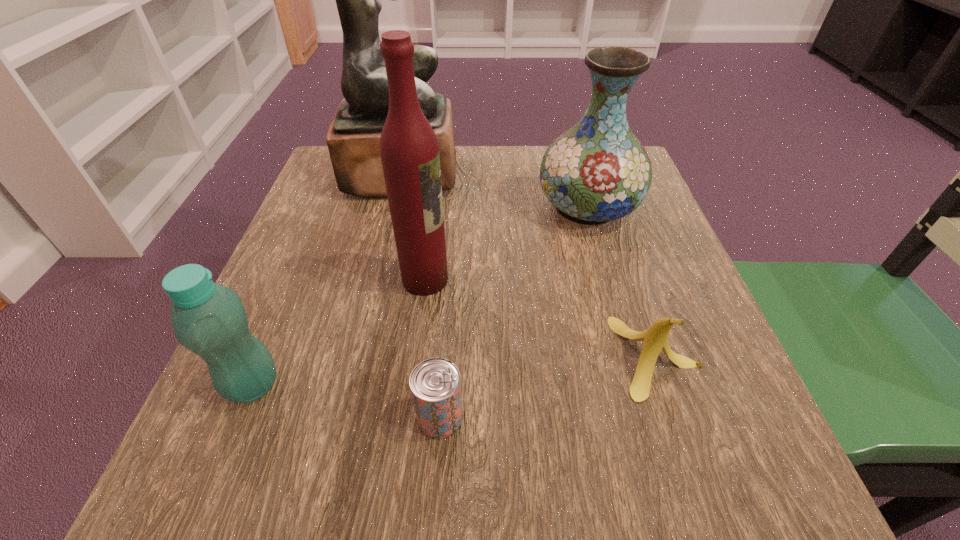
Where is `the tallest object`? the tallest object is located at coordinates (353, 139).

This screenshot has height=540, width=960. I want to click on the fifth shortest object, so click(409, 150).

At what (x,y) coordinates should I click in order to perform the action: click on the third farthest object. Please return your answer as a coordinate pair (x, y). Looking at the image, I should click on (409, 150).

Image resolution: width=960 pixels, height=540 pixels. Identify the location of vase. (597, 171).

Image resolution: width=960 pixels, height=540 pixels. I want to click on water bottle, so click(x=209, y=319).

Image resolution: width=960 pixels, height=540 pixels. Identify the location of banana. (656, 338).

Locate an element on the screen. beer can is located at coordinates (435, 383).

Image resolution: width=960 pixels, height=540 pixels. I want to click on vacant space positioned 0.090m in a relaxed pose on the sculpture, so click(x=494, y=174).

Locate an element on the screen. vacant space located 0.170m on the label of the third farthest object is located at coordinates (541, 279).

Where is `vacant space located on the front of the vase`? vacant space located on the front of the vase is located at coordinates 650,423.